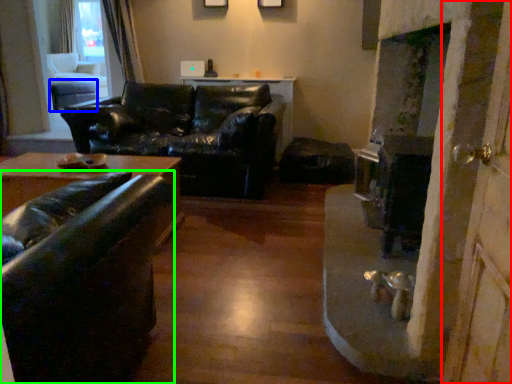
Question: Which object is the farthest from screen door (highlighted by a red box)? Choose among these: table (highlighted by a blue box) or studio couch (highlighted by a green box).

Choices:
 (A) table
 (B) studio couch

Answer: (A)